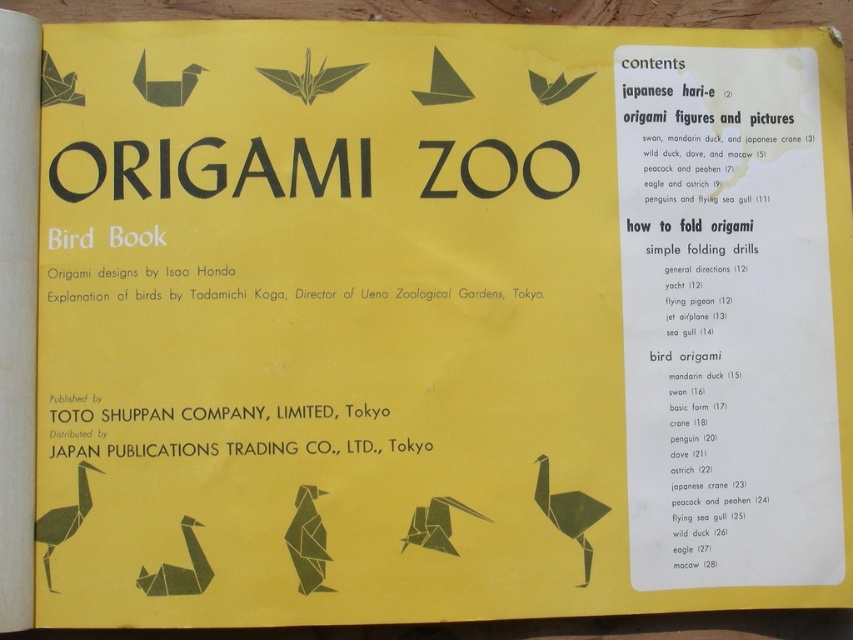
What is the spatial relationship between the green paper bird at center and the matte black ostrich at center on the book cover?

The green paper bird at center is located below the matte black ostrich at center on the book cover.